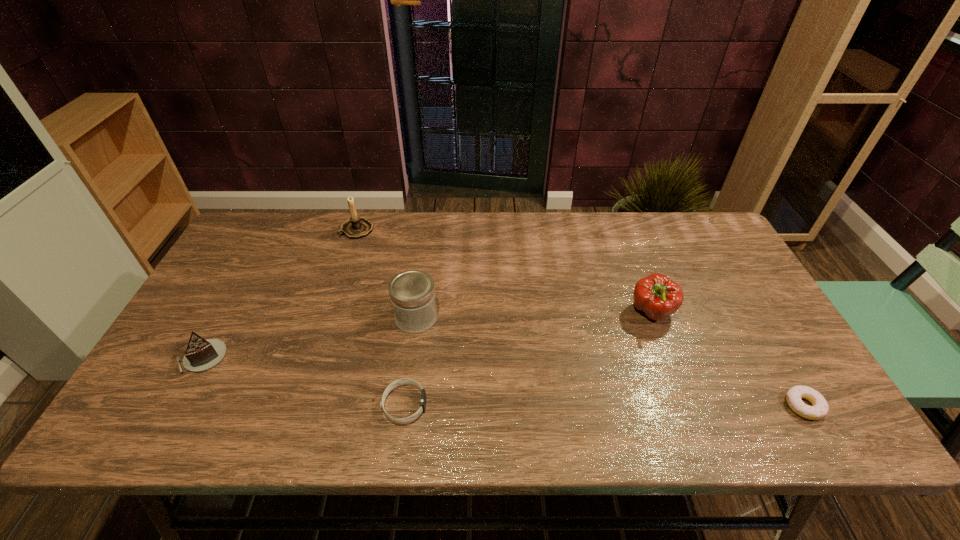
At what (x,y) coordinates should I click in order to perform the action: click on the fifth object from right to left. Please return your answer as a coordinate pair (x, y). The width and height of the screenshot is (960, 540). Looking at the image, I should click on 356,227.

Image resolution: width=960 pixels, height=540 pixels. I want to click on candle holder, so click(356, 227).

Image resolution: width=960 pixels, height=540 pixels. Identify the location of jar. (412, 293).

Locate an element on the screen. The height and width of the screenshot is (540, 960). pepper is located at coordinates (657, 296).

The height and width of the screenshot is (540, 960). I want to click on the fourth tallest object, so click(x=201, y=354).

Find the location of a particular element. the leftmost object is located at coordinates (201, 354).

Where is `the second shortest object`? the second shortest object is located at coordinates (405, 381).

This screenshot has width=960, height=540. What are the coordinates of `the shortest object` in the screenshot? It's located at 818,410.

Locate an element on the screen. the rightmost object is located at coordinates (x=818, y=410).

The width and height of the screenshot is (960, 540). I want to click on vacant area situated 0.310m on the left of the fifth object from right to left, so click(x=249, y=230).